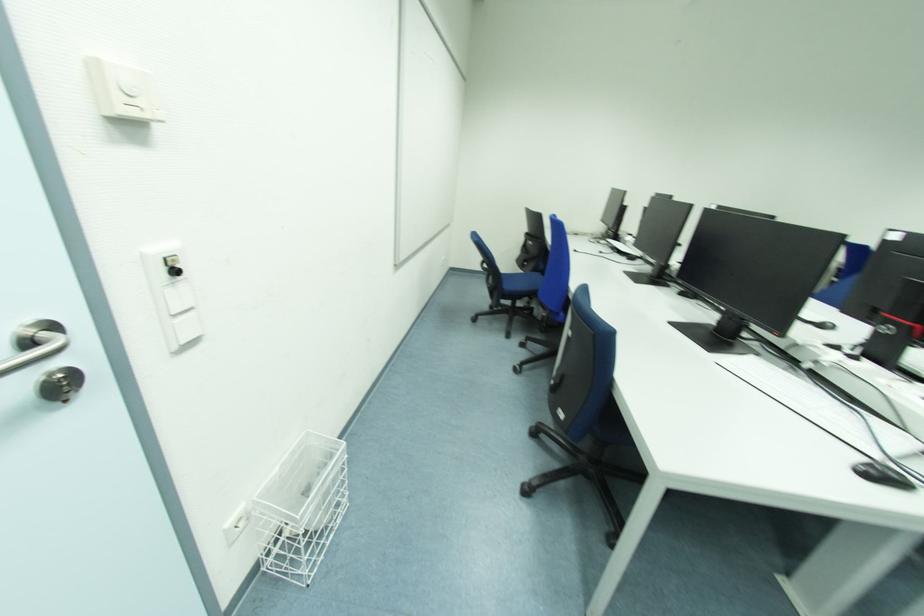
This screenshot has width=924, height=616. What do you see at coordinates (521, 281) in the screenshot?
I see `the blue chair sitting surface` at bounding box center [521, 281].